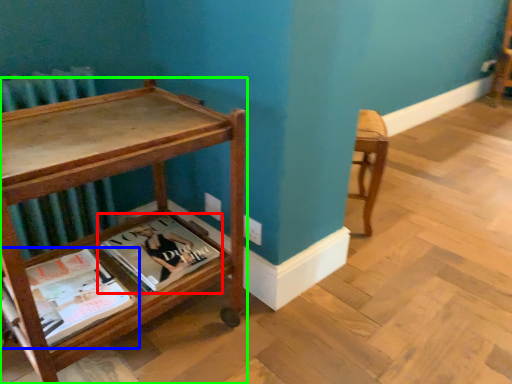
Question: Based on their relative distances, which object is farther from book (highlighted by a red box)? Choose from book (highlighted by a blue box) and table (highlighted by a green box).

Choices:
 (A) book
 (B) table

Answer: (B)